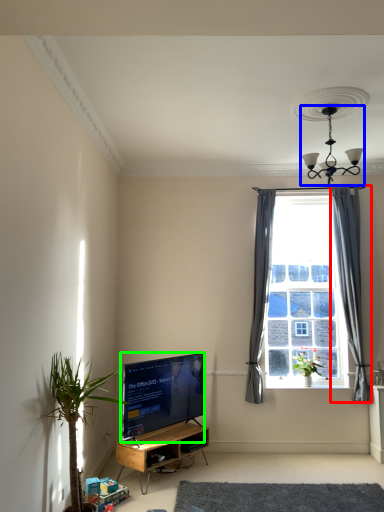
Question: Considering the real-world distances, which object is closest to curtain (highlighted by a red box)? light fixture (highlighted by a blue box) or television (highlighted by a green box).

Choices:
 (A) light fixture
 (B) television

Answer: (A)